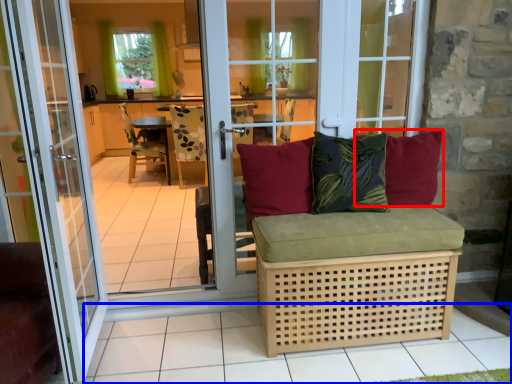
Question: Which point is closer to the camera, pillow (highlighted by a red box) or tile (highlighted by a blue box)?

Choices:
 (A) pillow
 (B) tile

Answer: (B)